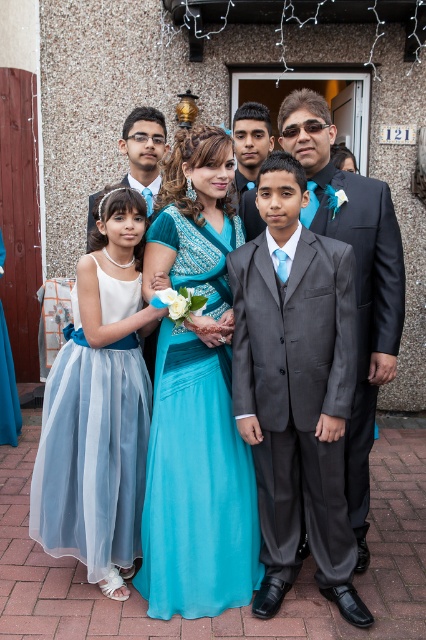
Question: Which of these objects is positioned closest to the shiny black suit at center?

Choices:
 (A) turquoise satin dress at center
 (B) matte gray suit at center

Answer: (A)

Question: Which is farther from the light blue tulle dress at center?

Choices:
 (A) turquoise satin dress at center
 (B) matte gray suit at center

Answer: (B)

Question: Is shiny gray suit at center bigger than matte black suit at center?

Choices:
 (A) yes
 (B) no

Answer: (A)

Question: Based on their relative distances, which object is nearer to the matte gray suit at center?

Choices:
 (A) turquoise satin dress at center
 (B) shiny black suit at center
 (C) shiny gray suit at center

Answer: (B)

Question: Is shiny gray suit at center smaller than matte black suit at center?

Choices:
 (A) yes
 (B) no

Answer: (B)

Question: Is turquoise satin dress at center to the right of matte gray suit at center from the viewer's perspective?

Choices:
 (A) yes
 (B) no

Answer: (B)